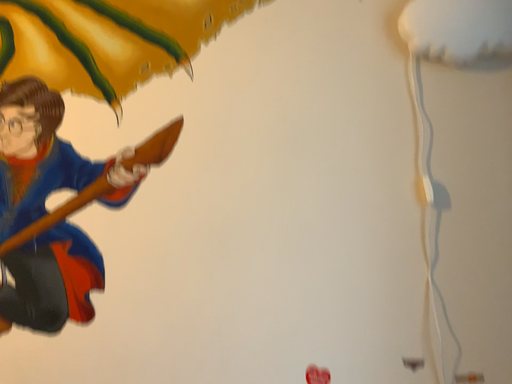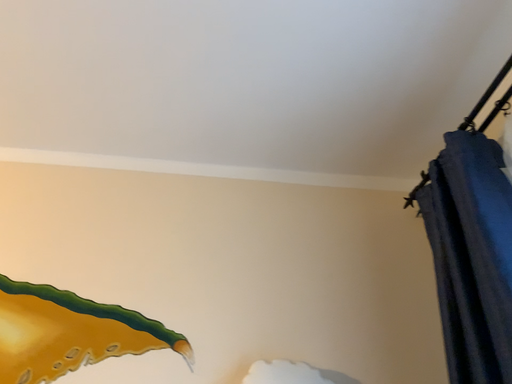
Question: How did the camera likely rotate when shooting the video?

Choices:
 (A) rotated right
 (B) rotated left

Answer: (A)